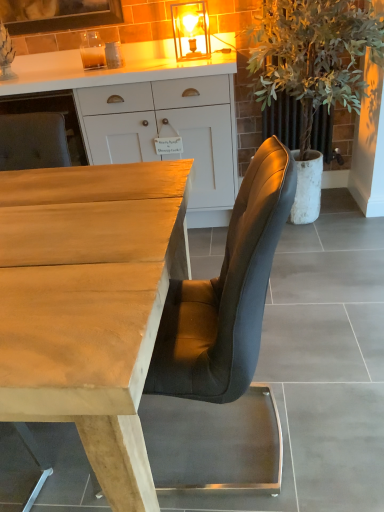
What do you see at coordinates (328, 74) in the screenshot?
I see `green leafy plant at right` at bounding box center [328, 74].

Measure the distance between point (56, 198) and camera.

1.20 meters.

In order to click on white wood cabinet at upper center in this screenshot , I will do `click(122, 71)`.

Is point (52, 57) positioned before point (194, 12)?

No, it is not.

From a real-world perspective, which object rests below the other?

white wood cabinet at upper center is physically lower.

Who is bigger, white wood cabinet at upper center or matte glass lampshade at upper center?

Bigger between the two is white wood cabinet at upper center.

Considering the sizes of white wood cabinet at upper center and matte glass lampshade at upper center in the image, is white wood cabinet at upper center wider or thinner than matte glass lampshade at upper center?

Considering their sizes, white wood cabinet at upper center looks broader than matte glass lampshade at upper center.

Is white wood cabinet at upper center a part of light brown wood desk at center?

No, light brown wood desk at center does not contain white wood cabinet at upper center.

Is point (37, 332) positioned before point (71, 75)?

Yes.

Can you confirm if light brown wood desk at center is positioned to the right of white wood cabinet at upper center?

No, light brown wood desk at center is not to the right of white wood cabinet at upper center.

From the image's perspective, would you say light brown wood desk at center is positioned over white wood cabinet at upper center?

Actually, light brown wood desk at center appears below white wood cabinet at upper center in the image.

Is light brown wood desk at center aimed at matte glass lampshade at upper center?

No, light brown wood desk at center does not turn towards matte glass lampshade at upper center.

Based on the photo, can you confirm if light brown wood desk at center is bigger than matte glass lampshade at upper center?

Correct, light brown wood desk at center is larger in size than matte glass lampshade at upper center.

This screenshot has width=384, height=512. Identify the location of desk in front of the matte glass lampshade at upper center. (89, 304).

Is light brown wood desk at center not close to matte glass lampshade at upper center?

light brown wood desk at center is far away from matte glass lampshade at upper center.

Based on the photo, would you say white wood cabinet at upper center is inside or outside light brown wood desk at center?

white wood cabinet at upper center is not enclosed by light brown wood desk at center.

Looking at this image, considering the relative sizes of white wood cabinet at upper center and light brown wood desk at center in the image provided, is white wood cabinet at upper center thinner than light brown wood desk at center?

Yes, white wood cabinet at upper center is thinner than light brown wood desk at center.

From the image's perspective, which one is positioned higher, white wood cabinet at upper center or light brown wood desk at center?

white wood cabinet at upper center appears higher in the image.

Is white wood cabinet at upper center in front of or behind light brown wood desk at center in the image?

white wood cabinet at upper center is positioned farther from the viewer than light brown wood desk at center.

Which point is more forward, (196, 18) or (279, 64)?

Positioned in front is point (279, 64).

From the image's perspective, does matte glass lampshade at upper center appear lower than green leafy plant at right?

Incorrect, from the image's perspective, matte glass lampshade at upper center is higher than green leafy plant at right.

Is matte glass lampshade at upper center facing towards green leafy plant at right?

No, matte glass lampshade at upper center is not aimed at green leafy plant at right.

Is white wood cabinet at upper center at the back of green leafy plant at right?

No, green leafy plant at right is not facing away from white wood cabinet at upper center.

Is green leafy plant at right taller than white wood cabinet at upper center?

Correct, green leafy plant at right is much taller as white wood cabinet at upper center.

How different are the orientations of green leafy plant at right and white wood cabinet at upper center in degrees?

3.08 degrees separate the facing orientations of green leafy plant at right and white wood cabinet at upper center.

Does green leafy plant at right appear on the right side of white wood cabinet at upper center?

Indeed, green leafy plant at right is positioned on the right side of white wood cabinet at upper center.

Is matte glass lampshade at upper center wider than white wood cabinet at upper center?

Incorrect, the width of matte glass lampshade at upper center does not surpass that of white wood cabinet at upper center.

Relative to white wood cabinet at upper center, is matte glass lampshade at upper center in front or behind?

Clearly, matte glass lampshade at upper center is behind white wood cabinet at upper center.

Can you confirm if matte glass lampshade at upper center is positioned to the right of white wood cabinet at upper center?

Yes.

The height and width of the screenshot is (512, 384). Identify the location of light fixture above the white wood cabinet at upper center (from a real-world perspective). (191, 30).

Identify the location of cabinetry behind the light brown wood desk at center. This screenshot has width=384, height=512. (122, 71).

Considering their positions, is green leafy plant at right positioned closer to light brown wood desk at center than matte glass lampshade at upper center?

green leafy plant at right is closer to light brown wood desk at center.

Estimate the real-world distances between objects in this image. Which object is further from green leafy plant at right, matte glass lampshade at upper center or light brown wood desk at center?

The object further to green leafy plant at right is light brown wood desk at center.

Which object lies further to the anchor point white wood cabinet at upper center, light brown wood desk at center or matte glass lampshade at upper center?

light brown wood desk at center.

From the picture: From the image, which object appears to be nearer to matte glass lampshade at upper center, light brown wood desk at center or green leafy plant at right?

Among the two, green leafy plant at right is located nearer to matte glass lampshade at upper center.

When comparing their distances from white wood cabinet at upper center, does matte glass lampshade at upper center or green leafy plant at right seem closer?

matte glass lampshade at upper center is positioned closer to the anchor white wood cabinet at upper center.

Consider the image. Based on their spatial positions, is green leafy plant at right or light brown wood desk at center closer to white wood cabinet at upper center?

Based on the image, green leafy plant at right appears to be nearer to white wood cabinet at upper center.

Based on their spatial positions, is light brown wood desk at center or matte glass lampshade at upper center closer to green leafy plant at right?

Based on the image, matte glass lampshade at upper center appears to be nearer to green leafy plant at right.

From the image, which object appears to be farther from matte glass lampshade at upper center, white wood cabinet at upper center or green leafy plant at right?

Among the two, green leafy plant at right is located further to matte glass lampshade at upper center.

Image resolution: width=384 pixels, height=512 pixels. I want to click on light fixture between white wood cabinet at upper center and green leafy plant at right, so click(x=191, y=30).

Image resolution: width=384 pixels, height=512 pixels. Find the location of `houseplant between light brown wood desk at center and matte glass lampshade at upper center along the z-axis`. houseplant between light brown wood desk at center and matte glass lampshade at upper center along the z-axis is located at coordinates (328, 74).

Where is `cabinetry between light brown wood desk at center and matte glass lampshade at upper center in the front-back direction`? cabinetry between light brown wood desk at center and matte glass lampshade at upper center in the front-back direction is located at coordinates (122, 71).

Where is `houseplant positioned between light brown wood desk at center and white wood cabinet at upper center from near to far`? Image resolution: width=384 pixels, height=512 pixels. houseplant positioned between light brown wood desk at center and white wood cabinet at upper center from near to far is located at coordinates (328, 74).